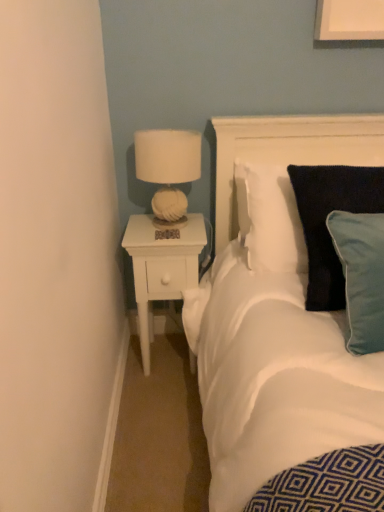
Question: Is velvety dark blue pillow at right in front of or behind white fabric headboard at upper right in the image?

Choices:
 (A) behind
 (B) front

Answer: (B)

Question: In terms of size, does velvety dark blue pillow at right appear bigger or smaller than white fabric headboard at upper right?

Choices:
 (A) big
 (B) small

Answer: (B)

Question: Which of these objects is positioned farthest from the white fabric lampshade at upper right?

Choices:
 (A) white wood nightstand at left
 (B) white fabric headboard at upper right
 (C) velvety dark blue pillow at right

Answer: (C)

Question: Which is nearer to the white wood nightstand at left?

Choices:
 (A) white fabric lampshade at upper right
 (B) velvety dark blue pillow at right
 (C) white fabric headboard at upper right

Answer: (A)